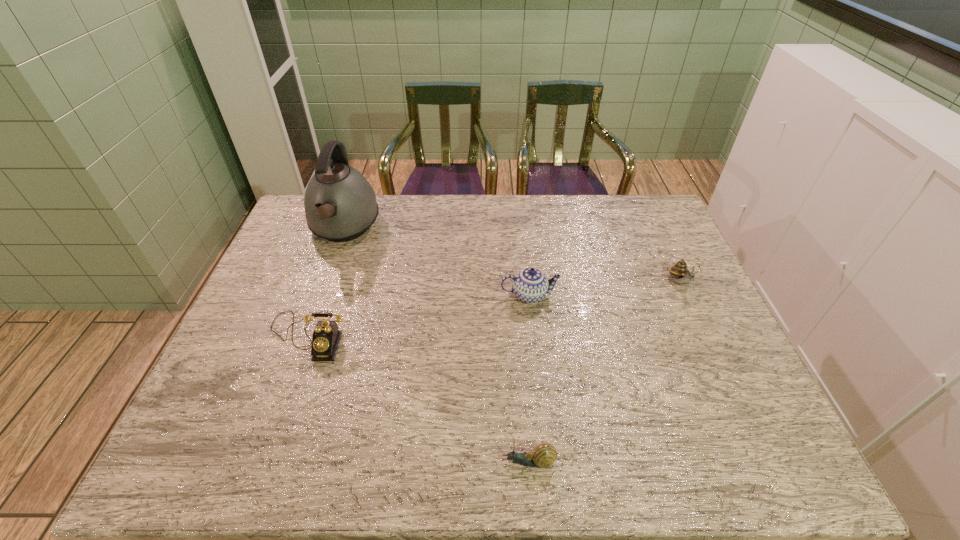
Where is `blank space located at the spout of the chinaware`? The image size is (960, 540). blank space located at the spout of the chinaware is located at coordinates (544, 429).

You are a GUI agent. You are given a task and a screenshot of the screen. Output one action in this format:
    pyautogui.click(x=<x>, y=<y>)
    Task: Click on the vacant space situated on the dial of the second nearest object
    
    Given the screenshot: What is the action you would take?
    pyautogui.click(x=271, y=443)

Identify the location of vacant space situated 0.350m on the front-facing side of the nearest object. The width and height of the screenshot is (960, 540). (336, 462).

This screenshot has width=960, height=540. Identify the location of blank space located 0.210m on the front-facing side of the nearest object. (402, 462).

Image resolution: width=960 pixels, height=540 pixels. I want to click on free spot located 0.200m on the front-facing side of the nearest object, so click(x=407, y=462).

Locate an element on the screen. object located in the far edge section of the desktop is located at coordinates (340, 205).

Locate an element on the screen. object that is at the near edge is located at coordinates (544, 455).

I want to click on kettle situated at the left edge, so click(340, 205).

You are a GUI agent. You are given a task and a screenshot of the screen. Output one action in this format:
    pyautogui.click(x=<x>, y=<y>)
    Task: Click on the telephone that is at the left edge
    The width and height of the screenshot is (960, 540).
    Given the screenshot: What is the action you would take?
    pyautogui.click(x=326, y=337)

You are a GUI agent. You are given a task and a screenshot of the screen. Output one action in this format:
    pyautogui.click(x=<x>, y=<y>)
    Task: Click on the object located in the right edge section of the desktop
    The width and height of the screenshot is (960, 540).
    Given the screenshot: What is the action you would take?
    pyautogui.click(x=681, y=274)